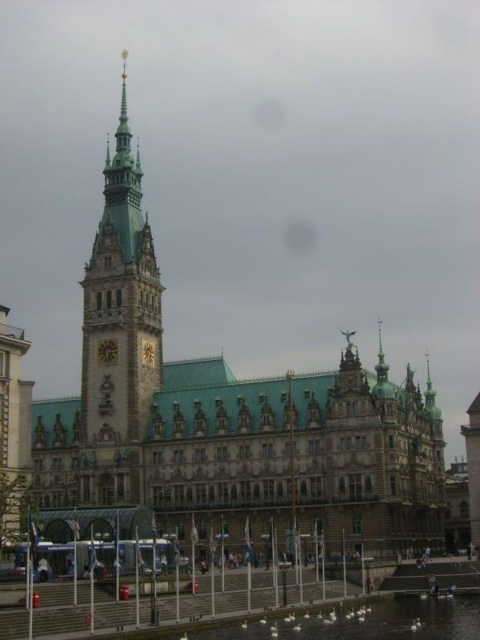
You are standing at the point labeled point (228,419) on the green metallic building at center. Which direction should you face to see the clock tower?

You should face towards the center of the green metallic building at center because the clock tower is located there.